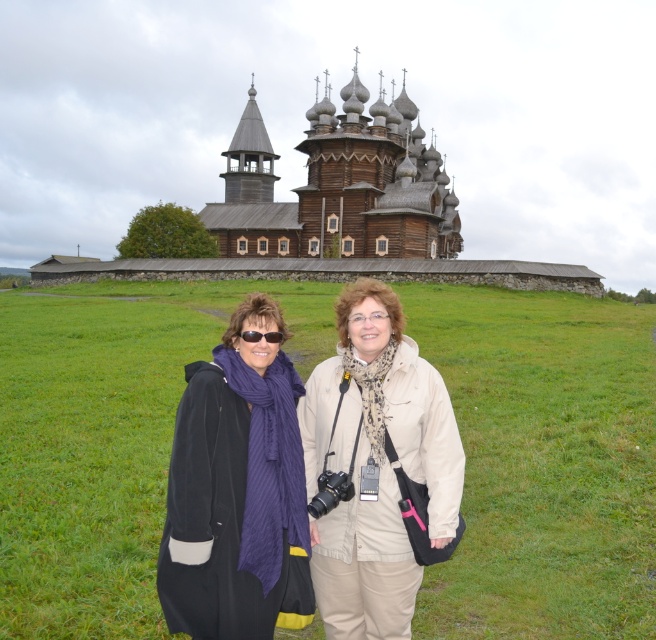
Is green grass at center shorter than black fabric coat at center?

In fact, green grass at center may be taller than black fabric coat at center.

Which of these two, green grass at center or black fabric coat at center, stands taller?

With more height is green grass at center.

Describe the element at coordinates (544, 461) in the screenshot. I see `green grass at center` at that location.

Where is `green grass at center`? green grass at center is located at coordinates (544, 461).

Can you confirm if purple wool scarf at left is positioned above black plastic goggles at center?

No.

Which is above, purple wool scarf at left or black plastic goggles at center?

black plastic goggles at center is above.

Does point (266, 307) lie behind point (258, 337)?

Yes, it is behind point (258, 337).

Locate an element on the screen. The width and height of the screenshot is (656, 640). purple wool scarf at left is located at coordinates (237, 492).

Does green grass at center appear on the right side of black plastic goggles at center?

No, green grass at center is not to the right of black plastic goggles at center.

Which of these two, green grass at center or black plastic goggles at center, stands taller?

Standing taller between the two is green grass at center.

Is point (140, 348) less distant than point (277, 330)?

That is False.

Locate an element on the screen. This screenshot has height=640, width=656. green grass at center is located at coordinates (544, 461).